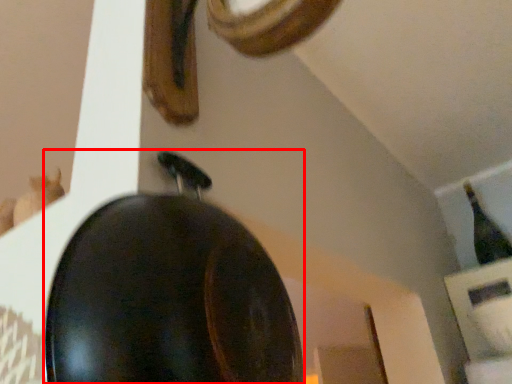
Question: From the image's perspective, what is the correct spatial positioning of frying pan (annotated by the red box) in reference to bottle?

Choices:
 (A) below
 (B) above

Answer: (B)